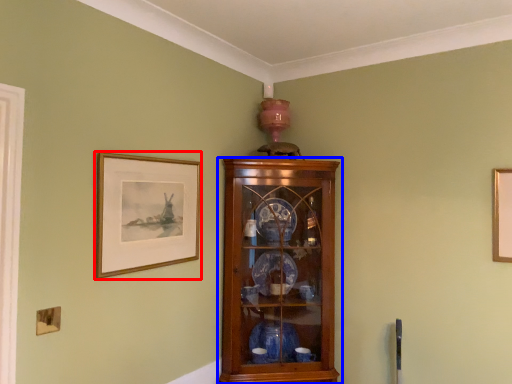
Question: Which of the following is the farthest to the observer, picture frame (highlighted by a red box) or cupboard (highlighted by a blue box)?

Choices:
 (A) picture frame
 (B) cupboard

Answer: (B)